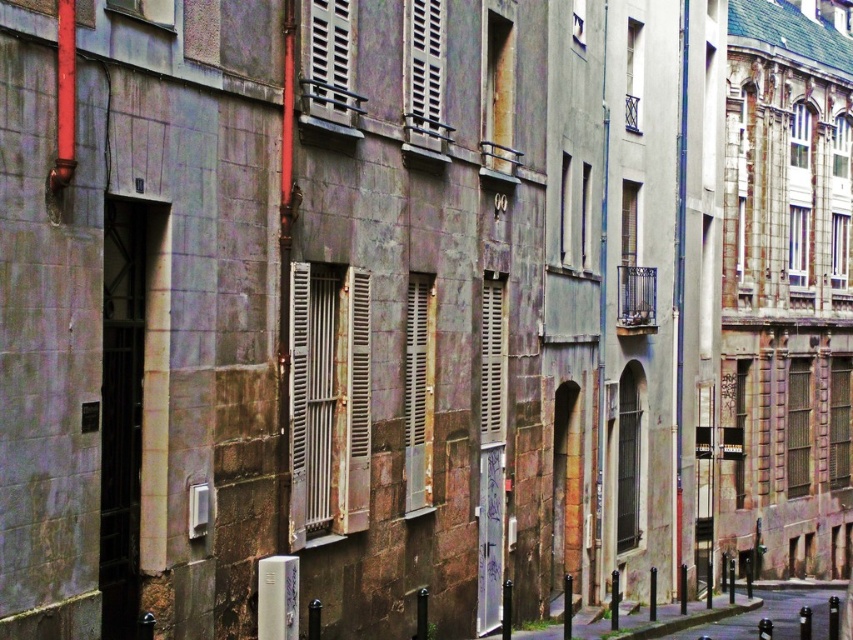
You are standing on the narrow urban street and want to locate the white wooden shutters at center. According to the scene description, where exactly are they positioned in relation to the weathered building with the muted grayish brown facade?

The white wooden shutters at center are located on the weathered building with the muted grayish brown facade, specifically at point [329,58].

You are a window cleaner who needs to reach both the rusty metal shutter at center and the white wooden shutter at center. Which shutter will require a taller ladder to clean?

The rusty metal shutter at center is much taller than the white wooden shutter at center, so you will need a taller ladder to clean the rusty metal shutter at center.